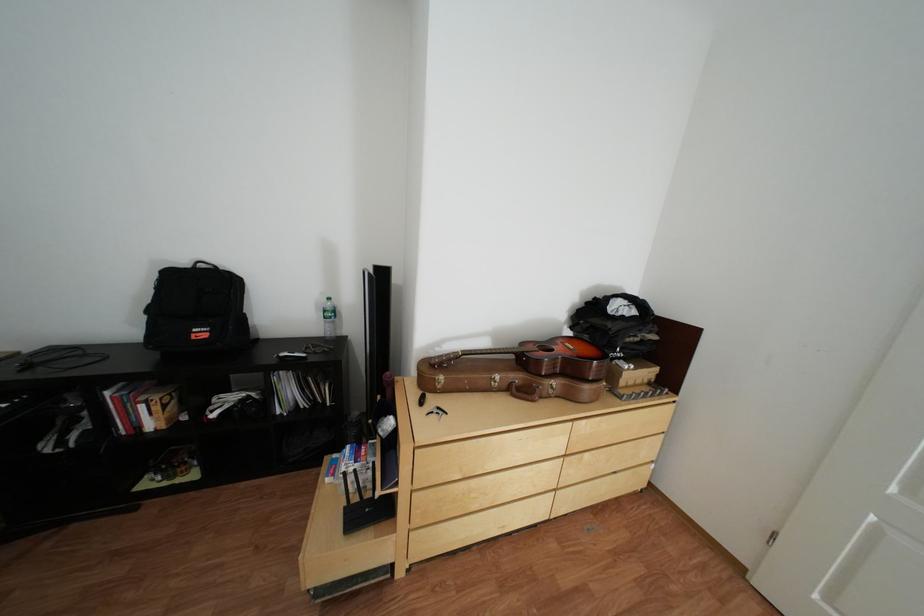
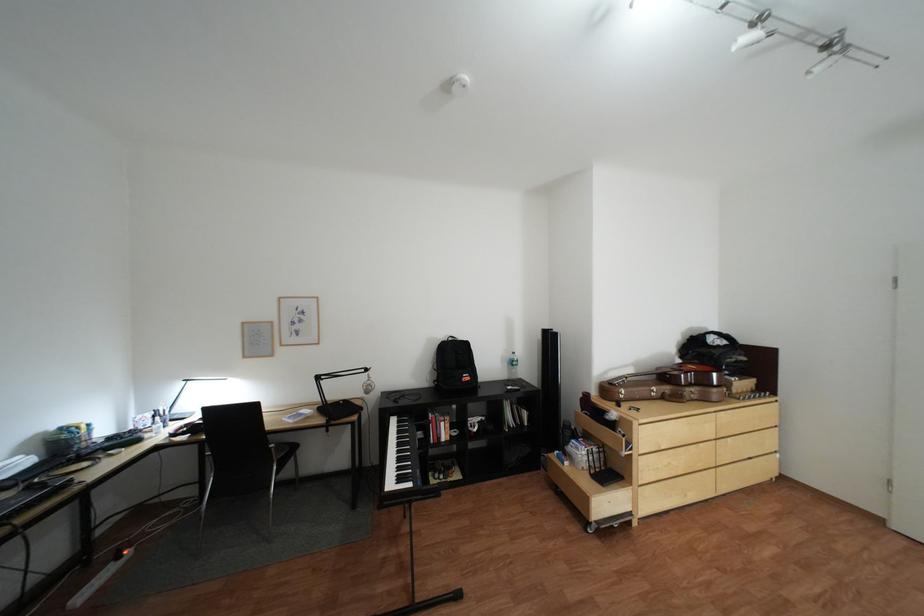
The images are taken continuously from a first-person perspective. In which direction are you moving?

The cameraman walked toward left, backward.